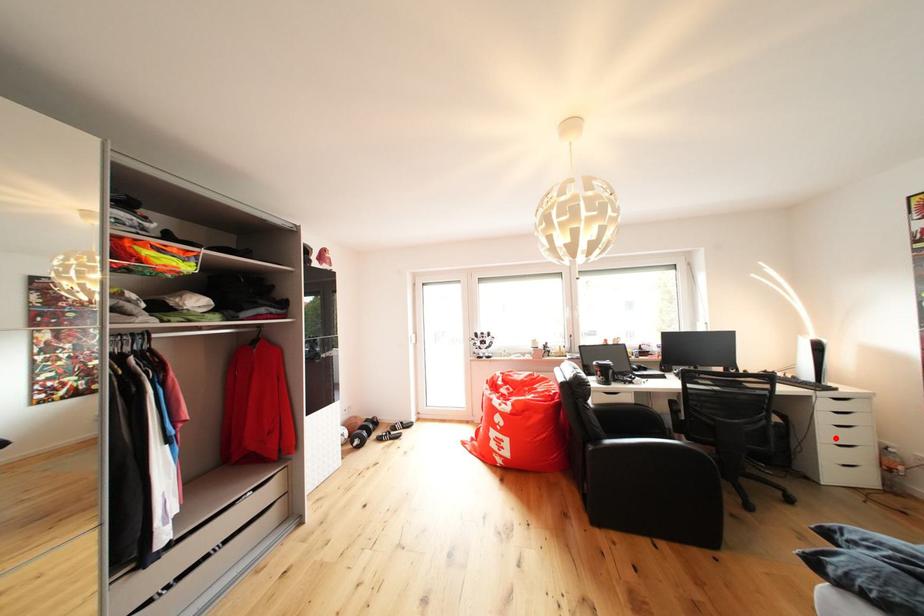
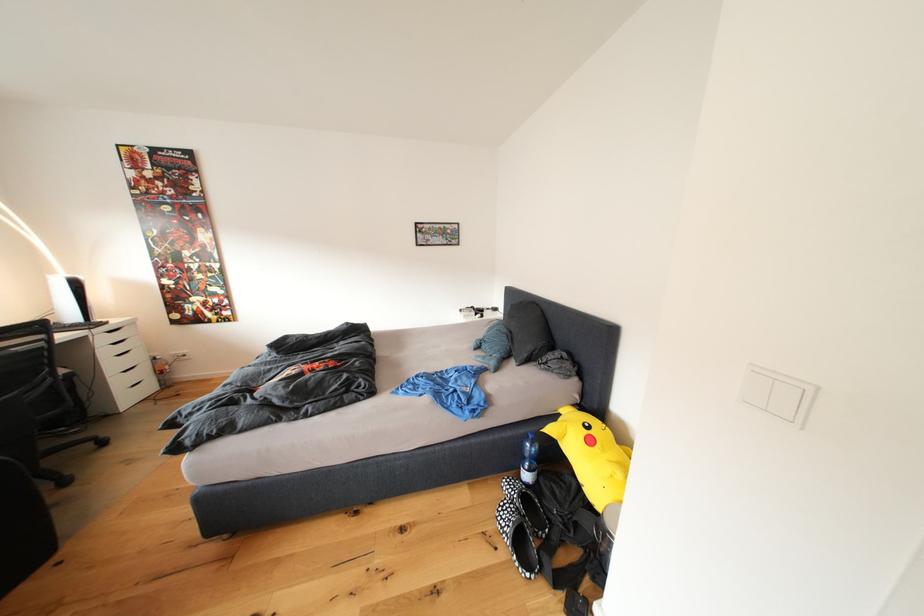
Question: A red point is marked in image1. In image2, is the corresponding 3D point closer to the camera or farther? Reply with the corresponding letter.

Choices:
 (A) The corresponding 3D point is closer.
 (B) The corresponding 3D point is farther.

Answer: (B)